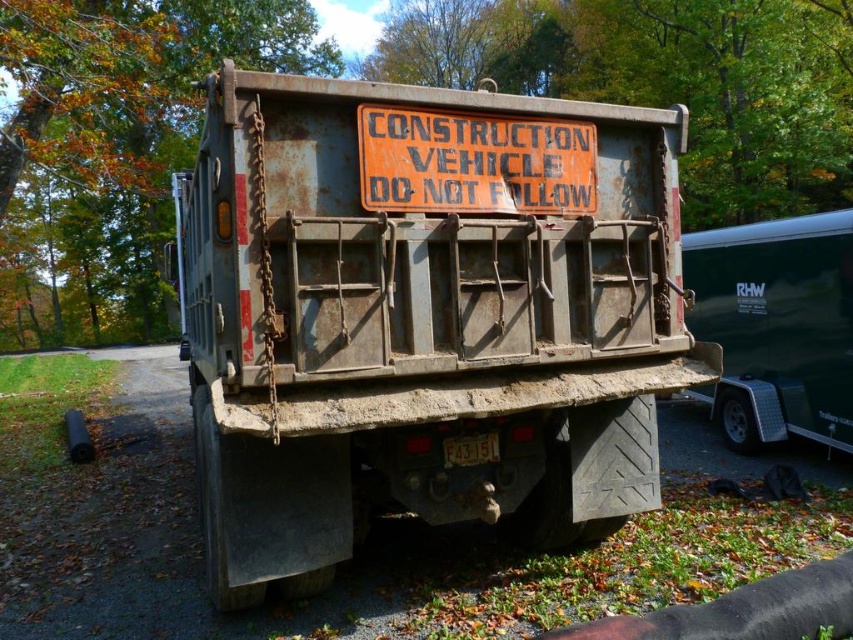
Question: Which object is positioned closest to the rusty metal construction vehicle at center?

Choices:
 (A) orange weathered sign at center
 (B) metallic trailer at right

Answer: (A)

Question: Does metallic trailer at right appear under orange weathered sign at center?

Choices:
 (A) yes
 (B) no

Answer: (A)

Question: Is metallic trailer at right positioned before orange weathered sign at center?

Choices:
 (A) no
 (B) yes

Answer: (A)

Question: Among these objects, which one is nearest to the camera?

Choices:
 (A) metallic trailer at right
 (B) orange weathered sign at center

Answer: (B)

Question: Among these objects, which one is farthest from the camera?

Choices:
 (A) rusty metal construction vehicle at center
 (B) metallic trailer at right

Answer: (B)

Question: Is metallic trailer at right thinner than orange weathered sign at center?

Choices:
 (A) no
 (B) yes

Answer: (B)